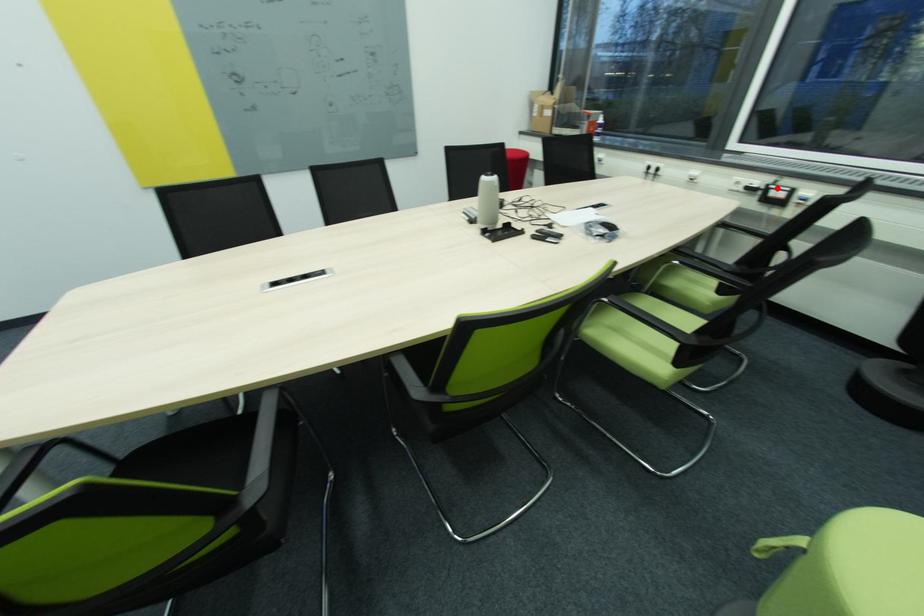
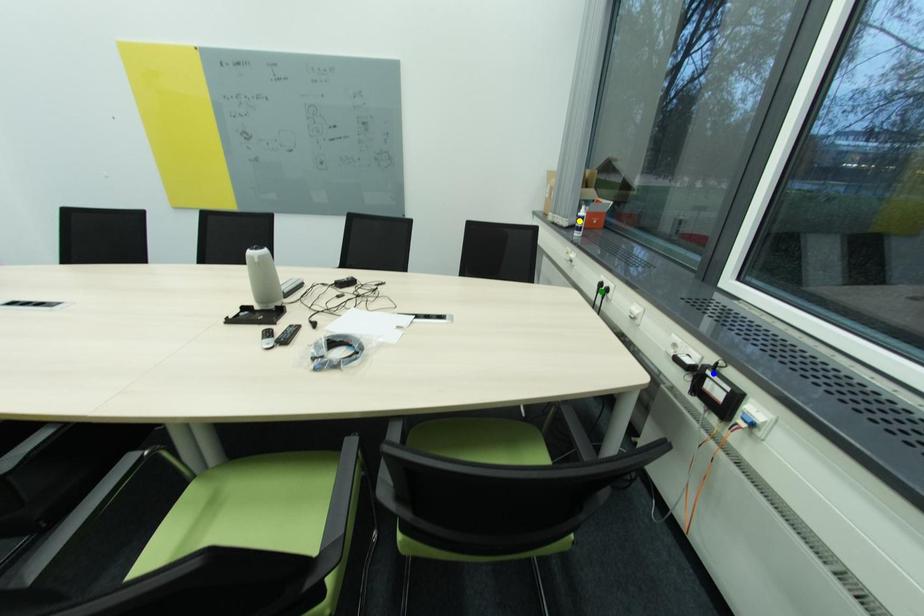
Question: I am providing you with two images of the same scene from different viewpoints. A red point is marked on the first image. You are given multiple points on the second image. Can you choose the point in image 2 that corresponds to the point in image 1?

Choices:
 (A) yellow point
 (B) blue point
 (C) green point

Answer: (B)